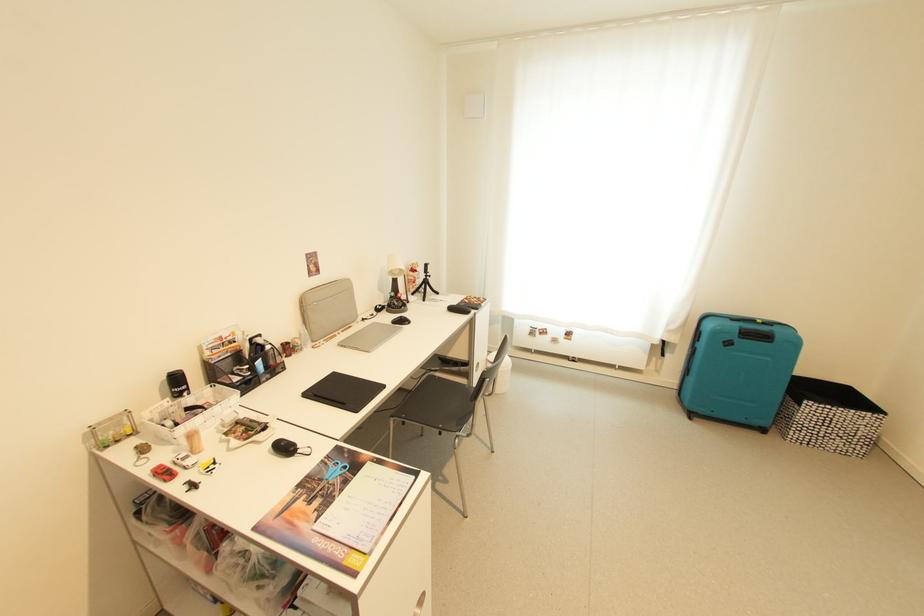
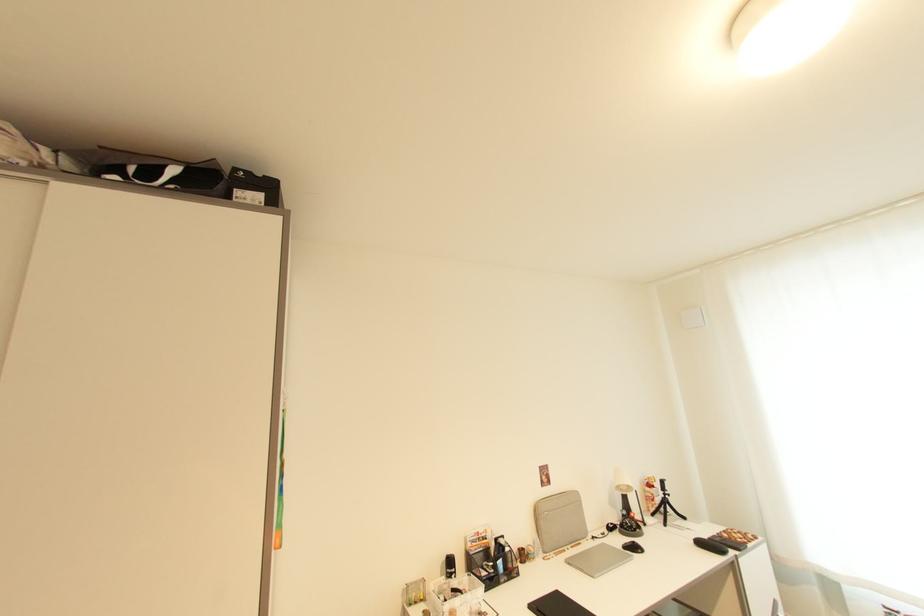
Locate, in the second image, the point that corresponds to the point at 314,315 in the first image.

(546, 525)